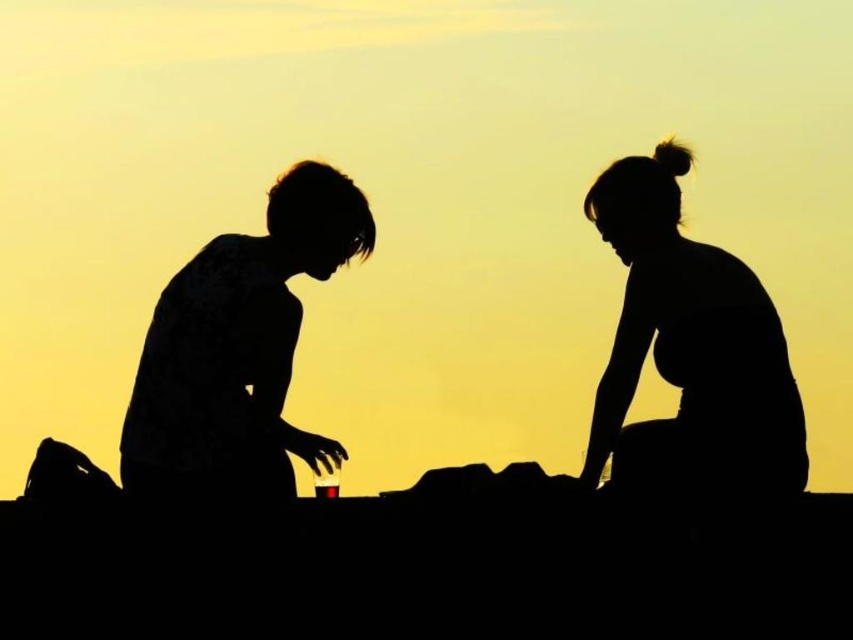
Can you confirm if silhouette figures at center is positioned to the left of silhouette shirt at left?

In fact, silhouette figures at center is to the right of silhouette shirt at left.

Between silhouette figures at center and silhouette shirt at left, which one is positioned lower?

silhouette shirt at left is lower down.

Find the location of a particular element. This screenshot has width=853, height=640. silhouette figures at center is located at coordinates (688, 355).

Can you confirm if silhouette figures at center is bigger than silhouette hair at upper right?

Yes.

Does silhouette figures at center appear over silhouette hair at upper right?

Indeed, silhouette figures at center is positioned over silhouette hair at upper right.

From the picture: Measure the distance between silhouette figures at center and camera.

silhouette figures at center is 20.21 feet away from camera.

Where is `silhouette figures at center`? silhouette figures at center is located at coordinates (688, 355).

Locate an element on the screen. This screenshot has height=640, width=853. silhouette hair at upper right is located at coordinates (689, 349).

Where is `silhouette hair at upper right`? This screenshot has width=853, height=640. silhouette hair at upper right is located at coordinates tap(689, 349).